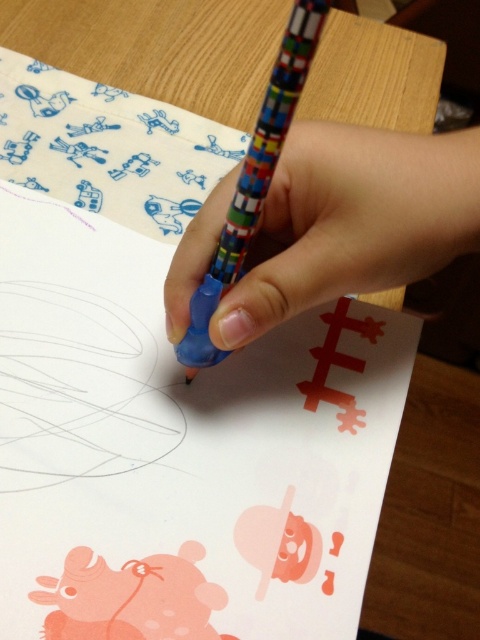
Based on the photo, you are an art teacher observing a student drawing with two pencils. The student is using the rubberized plastic pencil at center and the multicolored plastic pencil at center. Which pencil is positioned higher on the paper?

The rubberized plastic pencil at center is positioned higher because it is above the multicolored plastic pencil at center.

You are an art teacher observing a student drawing with two pencils. The student has a rubberized plastic pencil at center and a multicolored plastic pencil at center. Which pencil is positioned to the right of the other?

The rubberized plastic pencil at center is to the right of the multicolored plastic pencil at center.